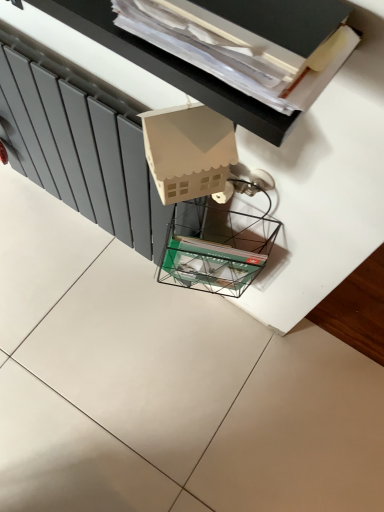
At what (x,y) coordinates should I click in order to perform the action: click on vacant area on top of matte cardboard house at upper center (from a real-world perspective). Please return your answer as a coordinate pair (x, y). Looking at the image, I should click on (234, 25).